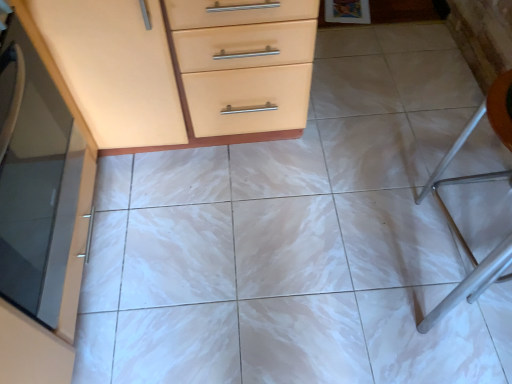
Where is `vacant region below matte wood chest of drawers at upper left, placed as the 2th chest of drawers when sorted from top to bottom (from a real-world perspective)`? The height and width of the screenshot is (384, 512). vacant region below matte wood chest of drawers at upper left, placed as the 2th chest of drawers when sorted from top to bottom (from a real-world perspective) is located at coordinates (205, 273).